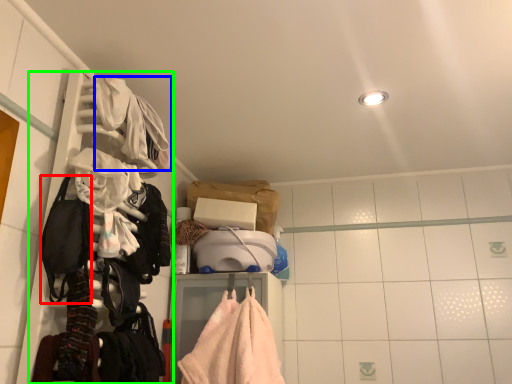
Question: Which object is positioned closest to gear (highlighted by a red box)? Select from clothing (highlighted by a blue box) and closet (highlighted by a green box).

Choices:
 (A) clothing
 (B) closet

Answer: (B)